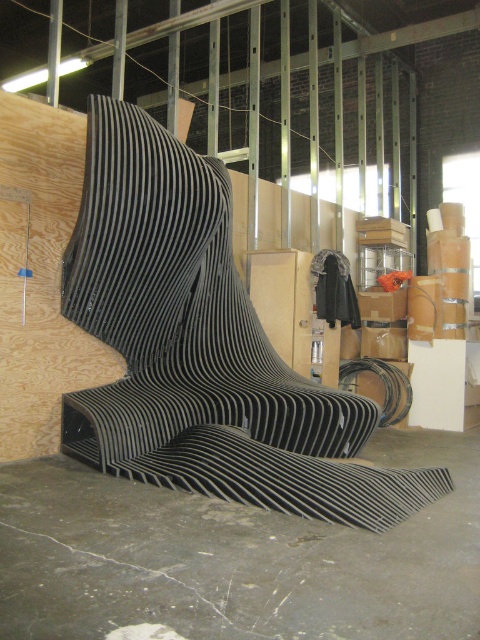
You are standing at the entrance of the construction site and need to reach the black striped bench at center. What are the coordinates of the bench to navigate towards?

The coordinates of the black striped bench at center are at point (202, 348).